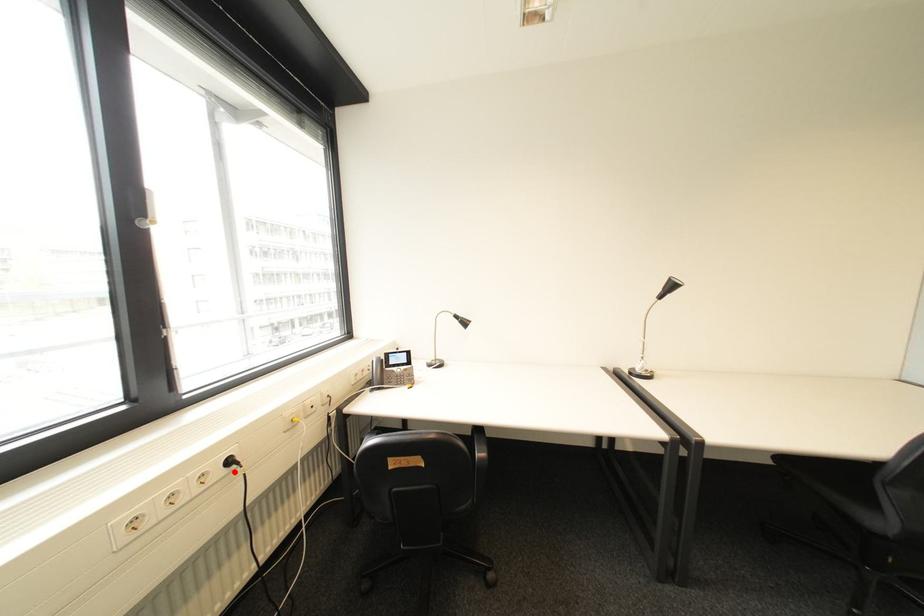
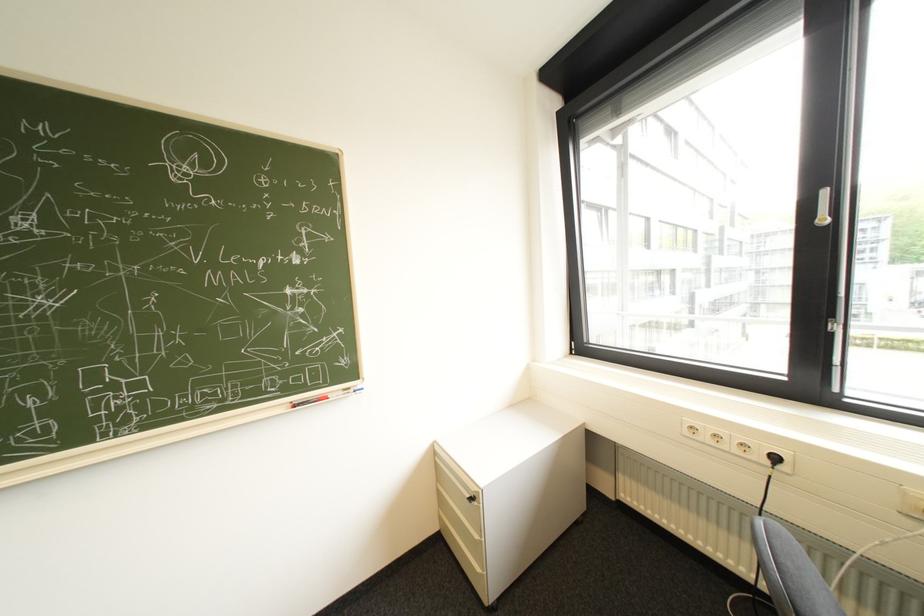
Locate, in the second image, the point that corresponds to the highlighted location in the first image.

(779, 463)